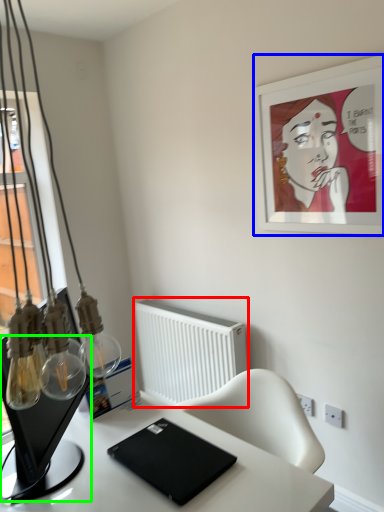
Question: Considering the real-world distances, which object is farthest from radiator (highlighted by a red box)? picture frame (highlighted by a blue box) or computer monitor (highlighted by a green box)?

Choices:
 (A) picture frame
 (B) computer monitor

Answer: (B)